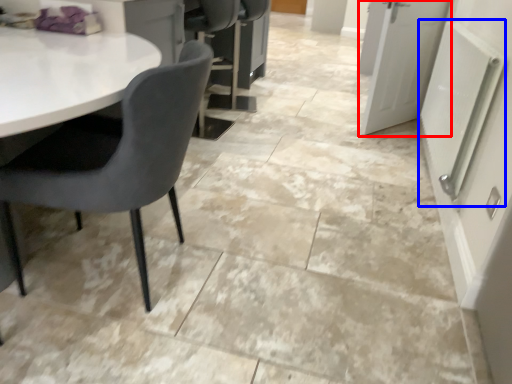
Question: Among these objects, which one is nearest to the camera, door (highlighted by a red box) or radiator (highlighted by a blue box)?

Choices:
 (A) door
 (B) radiator

Answer: (B)